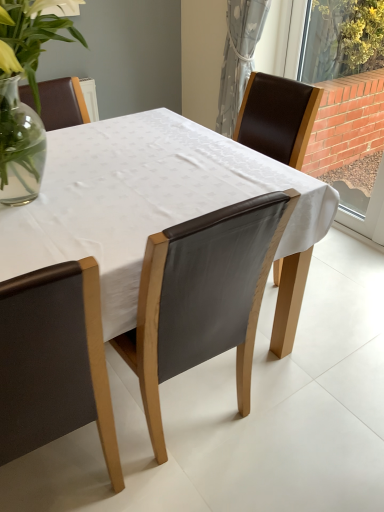
Identify the location of free point above white fabric table at center (from a real-world perspective). The width and height of the screenshot is (384, 512). [135, 170].